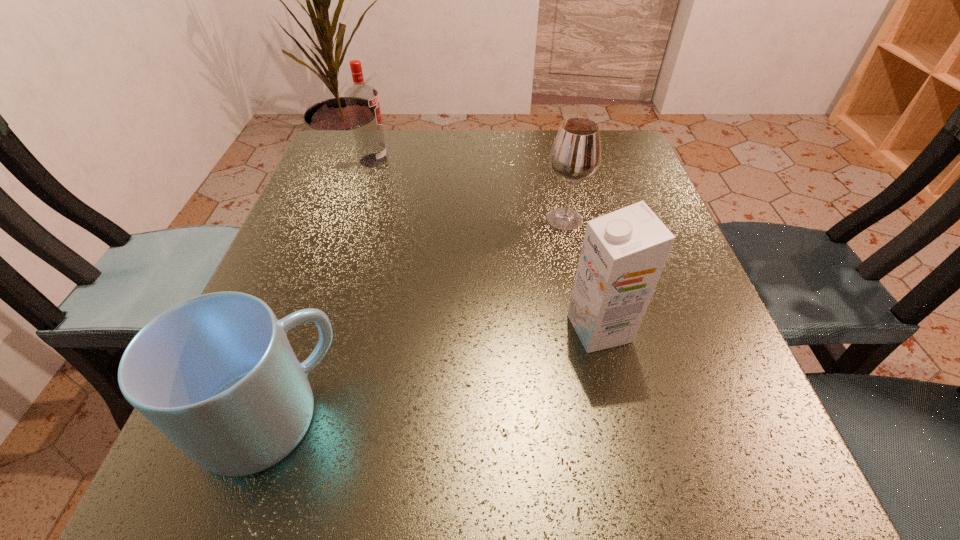
At what (x,y) coordinates should I click in order to perform the action: click on vacant point at the near right corner. Please return your answer as a coordinate pair (x, y). Image resolution: width=960 pixels, height=540 pixels. Looking at the image, I should click on (756, 512).

Identify the location of vacant space in between the nearest object and the second nearest object. The width and height of the screenshot is (960, 540). (434, 373).

This screenshot has width=960, height=540. Find the location of `unoccupied area between the mug and the carton`. unoccupied area between the mug and the carton is located at coordinates click(434, 373).

Image resolution: width=960 pixels, height=540 pixels. I want to click on vacant space that is in between the nearest object and the second nearest object, so click(434, 373).

Locate an element on the screen. empty space that is in between the carton and the nearest object is located at coordinates (434, 373).

Locate an element on the screen. The width and height of the screenshot is (960, 540). vacant space in between the wineglass and the mug is located at coordinates pos(417,318).

Where is `vacant region between the nearest object and the second nearest object`? The height and width of the screenshot is (540, 960). vacant region between the nearest object and the second nearest object is located at coordinates (434, 373).

I want to click on vacant area that lies between the vodka and the second nearest object, so click(487, 245).

This screenshot has width=960, height=540. Find the location of `unoccupied position between the wineglass and the mug`. unoccupied position between the wineglass and the mug is located at coordinates (417, 318).

At what (x,y) coordinates should I click in order to perform the action: click on free space between the mug and the second nearest object. Please return your answer as a coordinate pair (x, y). The image size is (960, 540). Looking at the image, I should click on (434, 373).